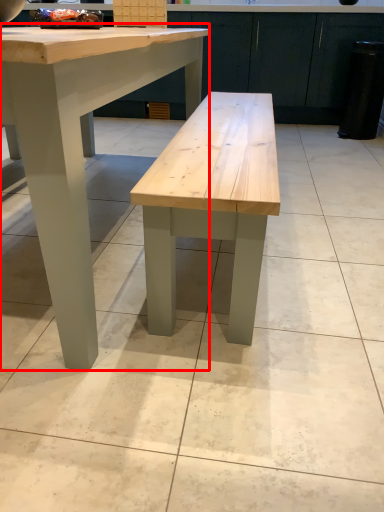
Question: From the image's perspective, what is the correct spatial positioning of table (annotated by the red box) in reference to cabinetry?

Choices:
 (A) below
 (B) above

Answer: (A)